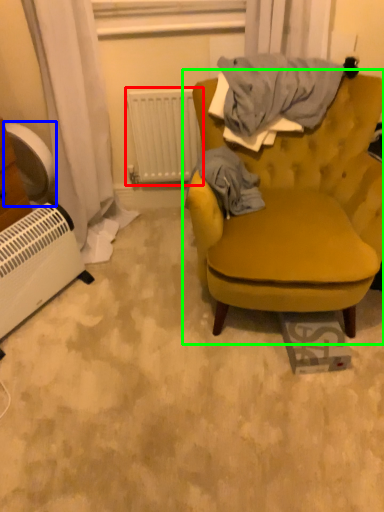
Question: Estimate the real-world distances between objects in this image. Which object is closer to radiator (highlighted by a red box), fan (highlighted by a blue box) or chair (highlighted by a green box)?

Choices:
 (A) fan
 (B) chair

Answer: (B)